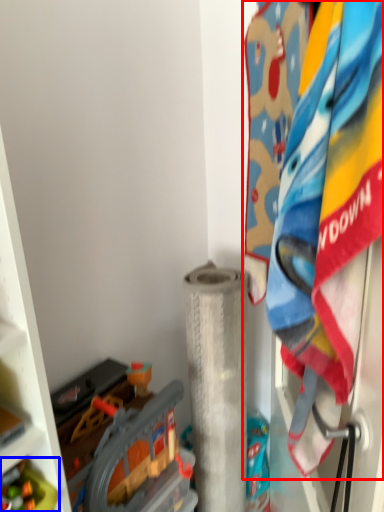
Question: Which point is closer to the camera, laundry (highlighted by a red box) or toy (highlighted by a blue box)?

Choices:
 (A) laundry
 (B) toy

Answer: (A)